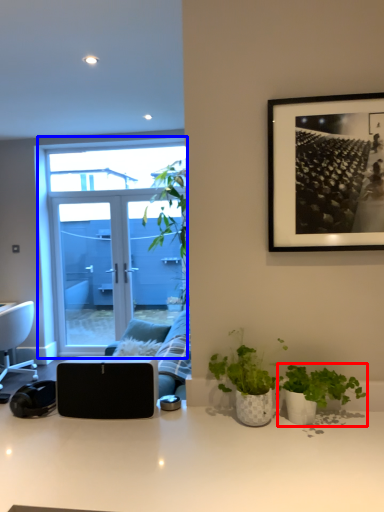
Question: Which object appears farthest to the camera in this image, houseplant (highlighted by a red box) or window (highlighted by a blue box)?

Choices:
 (A) houseplant
 (B) window

Answer: (B)